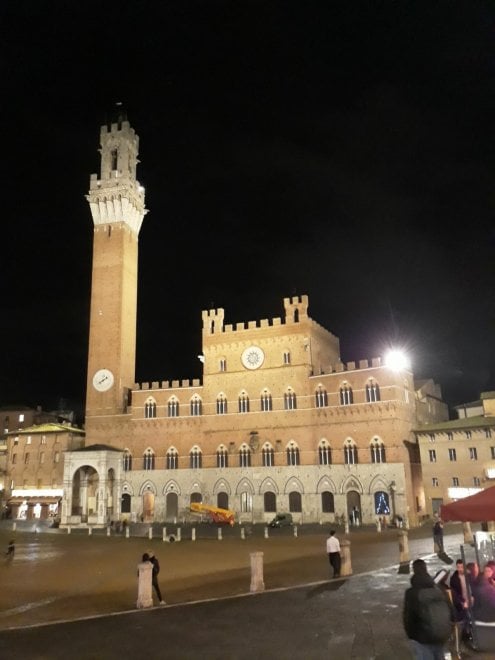
Find the location of a particular element. The width and height of the screenshot is (495, 660). bright spotlight is located at coordinates point(396,360).